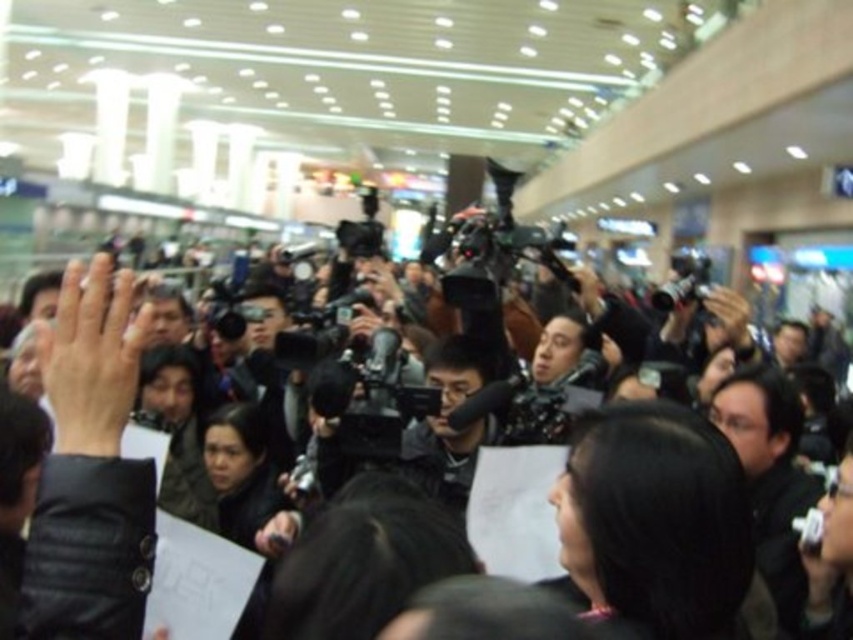
Can you confirm if black matte camera at center is positioned to the left of black plastic video camera at center?

Yes, black matte camera at center is to the left of black plastic video camera at center.

Between point (107, 547) and point (650, 301), which one is positioned in front?

Positioned in front is point (107, 547).

This screenshot has width=853, height=640. Identify the location of black matte camera at center. (90, 468).